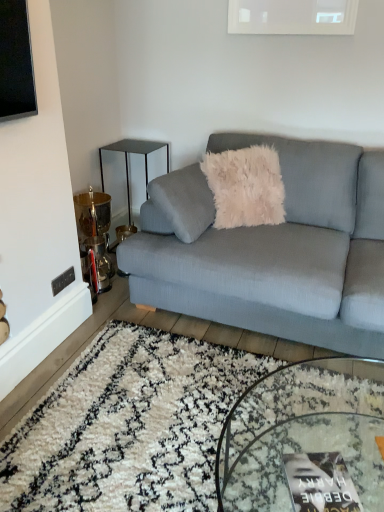
Where is `free spot behind clear glass coffee table at center`? The width and height of the screenshot is (384, 512). free spot behind clear glass coffee table at center is located at coordinates (233, 372).